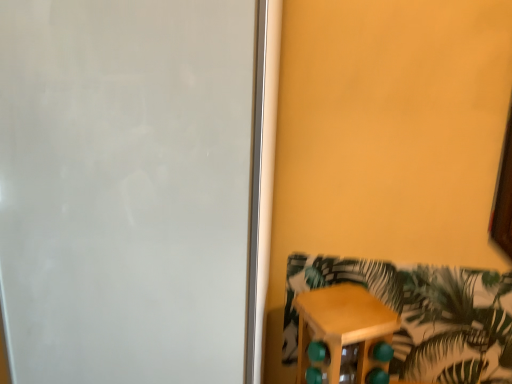
The image size is (512, 384). I want to click on wooden stool at lower right, so click(344, 332).

What do you see at coordinates (344, 332) in the screenshot?
I see `wooden stool at lower right` at bounding box center [344, 332].

Find the location of a particular element. Image resolution: width=512 pixels, height=384 pixels. white matte screen door at left is located at coordinates (125, 189).

Describe the element at coordinates (125, 189) in the screenshot. I see `white matte screen door at left` at that location.

What is the approximate height of white matte screen door at left?

white matte screen door at left is 33.73 inches tall.

In order to click on wooden stool at lower right in this screenshot , I will do `click(344, 332)`.

Does wooden stool at lower right appear on the right side of white matte screen door at left?

Yes.

Between wooden stool at lower right and white matte screen door at left, which one is positioned behind?

wooden stool at lower right.

Considering the positions of point (362, 300) and point (146, 47), is point (362, 300) closer or farther from the camera than point (146, 47)?

Clearly, point (362, 300) is more distant from the camera than point (146, 47).

From the image's perspective, which object appears higher, wooden stool at lower right or white matte screen door at left?

white matte screen door at left.

From a real-world perspective, does wooden stool at lower right sit lower than white matte screen door at left?

Yes, from a real-world perspective, wooden stool at lower right is below white matte screen door at left.

Considering the sizes of objects wooden stool at lower right and white matte screen door at left in the image provided, who is thinner, wooden stool at lower right or white matte screen door at left?

With smaller width is wooden stool at lower right.

From their relative heights in the image, would you say wooden stool at lower right is taller or shorter than white matte screen door at left?

wooden stool at lower right is shorter than white matte screen door at left.

Does wooden stool at lower right have a smaller size compared to white matte screen door at left?

Indeed, wooden stool at lower right has a smaller size compared to white matte screen door at left.

Is wooden stool at lower right not within white matte screen door at left?

Yes, wooden stool at lower right is outside of white matte screen door at left.

Is wooden stool at lower right positioned far away from white matte screen door at left?

No, wooden stool at lower right is not far away from white matte screen door at left.

Is wooden stool at lower right looking in the opposite direction of white matte screen door at left?

No.

How many degrees apart are the facing directions of wooden stool at lower right and white matte screen door at left?

28.7 degrees.

Find the location of `screen door that is in front of the wooden stool at lower right`. screen door that is in front of the wooden stool at lower right is located at coordinates (125, 189).

Considering the relative positions of white matte screen door at left and wooden stool at lower right in the image provided, is white matte screen door at left to the right of wooden stool at lower right from the viewer's perspective?

No.

Which object is further away from the camera taking this photo, white matte screen door at left or wooden stool at lower right?

wooden stool at lower right is more distant.

In the scene shown: Which is further, (181,120) or (332,375)?

The point (332,375) is farther from the camera.

From the image's perspective, is white matte screen door at left positioned above or below wooden stool at lower right?

Clearly, from the image's perspective, white matte screen door at left is above wooden stool at lower right.

From a real-world perspective, is white matte screen door at left physically below wooden stool at lower right?

Incorrect, from a real-world perspective, white matte screen door at left is higher than wooden stool at lower right.

Looking at this image, considering the sizes of white matte screen door at left and wooden stool at lower right in the image, is white matte screen door at left wider or thinner than wooden stool at lower right?

white matte screen door at left is wider than wooden stool at lower right.

Between white matte screen door at left and wooden stool at lower right, which one has more height?

white matte screen door at left.

Considering the sizes of objects white matte screen door at left and wooden stool at lower right in the image provided, who is smaller, white matte screen door at left or wooden stool at lower right?

wooden stool at lower right is smaller.

Consider the image. Is white matte screen door at left positioned beyond the bounds of wooden stool at lower right?

Yes, white matte screen door at left is located beyond the bounds of wooden stool at lower right.

Is white matte screen door at left not near wooden stool at lower right?

No, white matte screen door at left is not far away from wooden stool at lower right.

Is white matte screen door at left oriented towards wooden stool at lower right?

No, white matte screen door at left is not aimed at wooden stool at lower right.

What's the angular difference between white matte screen door at left and wooden stool at lower right's facing directions?

28.7 degrees.

This screenshot has width=512, height=384. Identify the location of screen door above the wooden stool at lower right (from a real-world perspective). (125, 189).

This screenshot has width=512, height=384. In order to click on screen door on the left side of wooden stool at lower right in this screenshot , I will do `click(125, 189)`.

At what (x,y) coordinates should I click in order to perform the action: click on screen door above the wooden stool at lower right (from a real-world perspective). Please return your answer as a coordinate pair (x, y). Looking at the image, I should click on (125, 189).